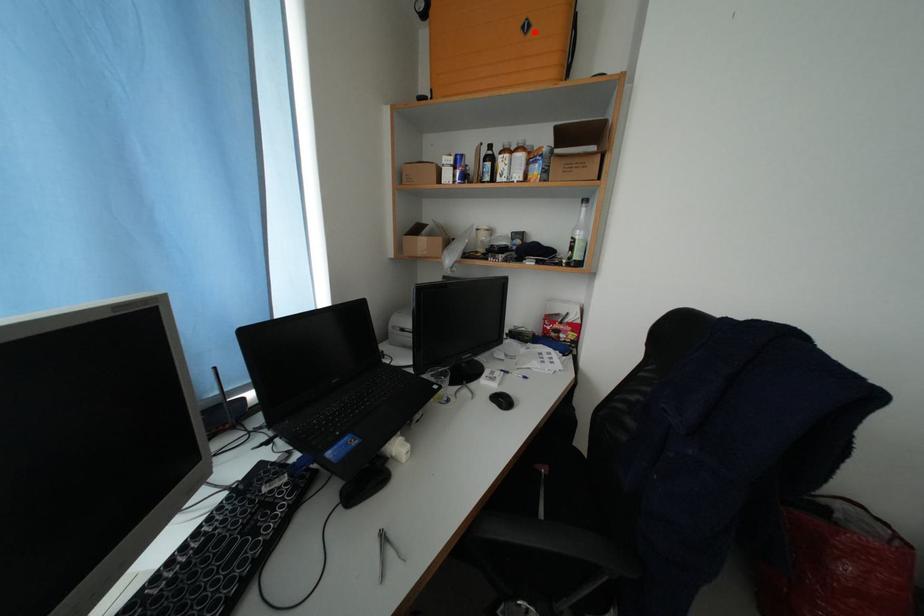
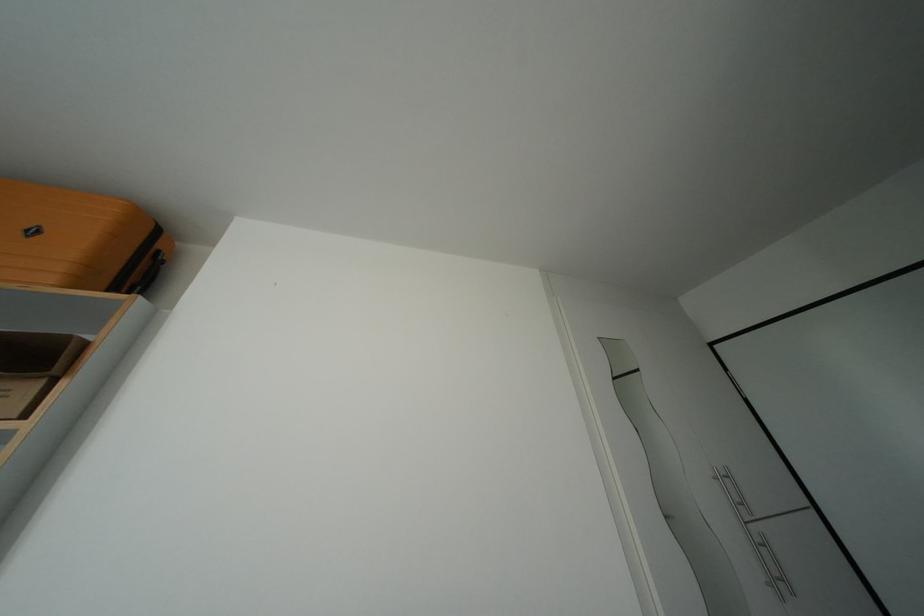
Locate, in the second image, the point that corresponds to the highlighted location in the first image.

(42, 237)